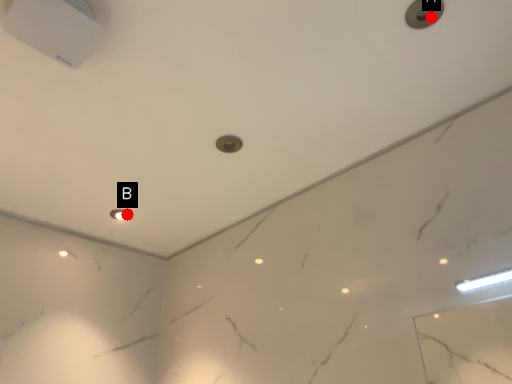
Question: Two points are circled on the image, labeled by A and B beside each circle. Which point is closer to the camera?

Choices:
 (A) A is closer
 (B) B is closer

Answer: (A)